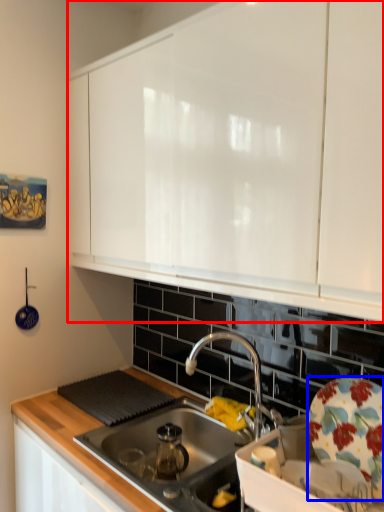
Question: Among these objects, which one is farthest to the camera, cabinetry (highlighted by a red box) or plate (highlighted by a blue box)?

Choices:
 (A) cabinetry
 (B) plate

Answer: (B)